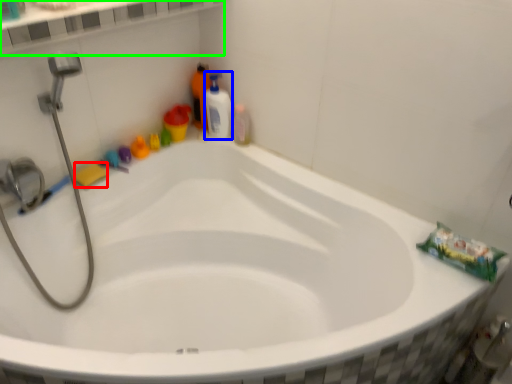
Question: Estimate the real-world distances between objects in this image. Which object is farther from soap (highlighted by a red box), cleaning product (highlighted by a blue box) or ledge (highlighted by a green box)?

Choices:
 (A) cleaning product
 (B) ledge

Answer: (B)